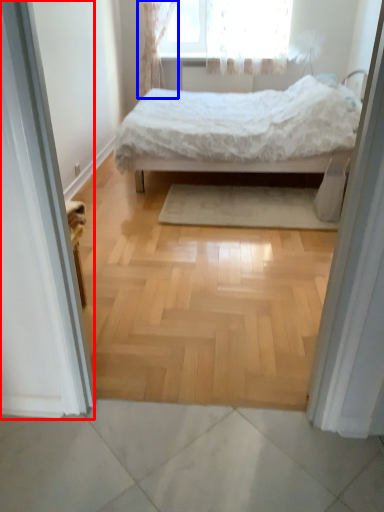
Question: Which object appears closest to the camera in this image, screen door (highlighted by a red box) or curtain (highlighted by a blue box)?

Choices:
 (A) screen door
 (B) curtain

Answer: (A)